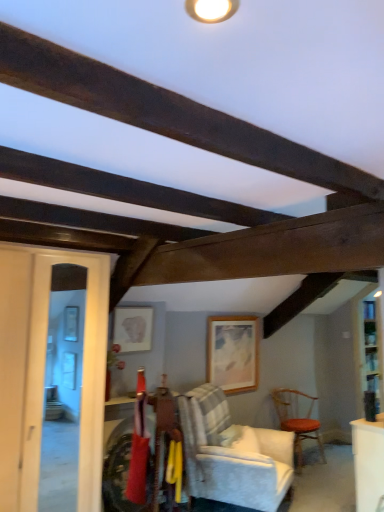
Question: Is wooden textured chair at right, the first chair positioned from the right, outside of wooden at center, which is counted as the second picture frame, starting from the front?

Choices:
 (A) no
 (B) yes

Answer: (B)

Question: From a real-world perspective, is wooden textured chair at right, the first chair positioned from the right, positioned under wooden at center, which is counted as the second picture frame, starting from the front, based on gravity?

Choices:
 (A) yes
 (B) no

Answer: (A)

Question: Is wooden textured chair at right, marked as the second chair in a front-to-back arrangement, bigger than wooden at center, which is counted as the first picture frame, starting from the back?

Choices:
 (A) yes
 (B) no

Answer: (A)

Question: From the image's perspective, is wooden textured chair at right, marked as the second chair in a front-to-back arrangement, under wooden at center, which is counted as the second picture frame, starting from the front?

Choices:
 (A) no
 (B) yes

Answer: (B)

Question: From the image's perspective, is wooden textured chair at right, the first chair positioned from the right, on top of wooden at center, the first picture frame viewed from the right?

Choices:
 (A) yes
 (B) no

Answer: (B)

Question: Is wooden textured chair at right, the 2th chair viewed from the left, positioned with its back to wooden at center, which is counted as the second picture frame, starting from the front?

Choices:
 (A) no
 (B) yes

Answer: (A)

Question: Is white upholstered chair at center, placed as the 1th chair when sorted from left to right, behind matte white picture frame at center, which is the 2th picture frame from back to front?

Choices:
 (A) yes
 (B) no

Answer: (B)

Question: From the image's perspective, is white upholstered chair at center, which ranks as the 2th chair in back-to-front order, located beneath matte white picture frame at center, which is the 2th picture frame from back to front?

Choices:
 (A) no
 (B) yes

Answer: (B)

Question: Can you confirm if white upholstered chair at center, marked as the first chair in a front-to-back arrangement, is bigger than matte white picture frame at center, marked as the second picture frame in a right-to-left arrangement?

Choices:
 (A) yes
 (B) no

Answer: (A)

Question: Does white upholstered chair at center, marked as the first chair in a front-to-back arrangement, contain matte white picture frame at center, the 1th picture frame viewed from the front?

Choices:
 (A) yes
 (B) no

Answer: (B)

Question: Is white upholstered chair at center, marked as the first chair in a front-to-back arrangement, thinner than matte white picture frame at center, which ranks as the first picture frame in left-to-right order?

Choices:
 (A) yes
 (B) no

Answer: (B)

Question: Can you confirm if white upholstered chair at center, marked as the first chair in a front-to-back arrangement, is taller than matte white picture frame at center, marked as the second picture frame in a right-to-left arrangement?

Choices:
 (A) yes
 (B) no

Answer: (A)

Question: Considering the relative positions of white upholstered chair at center, marked as the first chair in a front-to-back arrangement, and wooden at center, which is counted as the second picture frame, starting from the front, in the image provided, is white upholstered chair at center, marked as the first chair in a front-to-back arrangement, to the left of wooden at center, which is counted as the second picture frame, starting from the front, from the viewer's perspective?

Choices:
 (A) no
 (B) yes

Answer: (B)